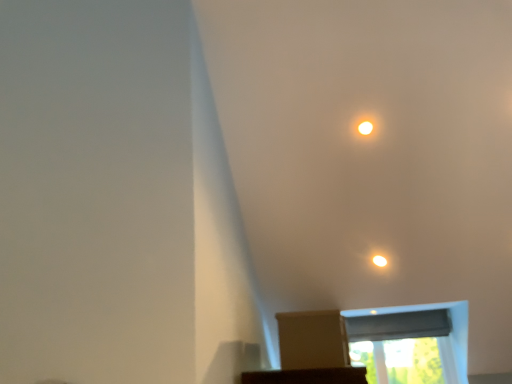
Question: From the image's perspective, is black fabric window screen at lower center, the second window screen when ordered from bottom to top, above or below transparent plastic window screen at upper center, marked as the 1th window screen in a bottom-to-top arrangement?

Choices:
 (A) below
 (B) above

Answer: (B)

Question: Considering their positions, is black fabric window screen at lower center, the 1th window screen in the top-to-bottom sequence, located in front of or behind transparent plastic window screen at upper center, arranged as the 2th window screen when viewed from the top?

Choices:
 (A) behind
 (B) front

Answer: (A)

Question: Which object is the farthest from the matte white light at upper center?

Choices:
 (A) transparent plastic window screen at upper center, arranged as the 2th window screen when viewed from the top
 (B) black fabric window screen at lower center, the second window screen when ordered from bottom to top
 (C) brown cardboard box at center
 (D) matte white light at upper center

Answer: (A)

Question: Based on their relative distances, which object is farther from the matte white light at upper center?

Choices:
 (A) brown cardboard box at center
 (B) black fabric window screen at lower center, the 1th window screen in the top-to-bottom sequence
 (C) transparent plastic window screen at upper center, arranged as the 2th window screen when viewed from the top
 (D) matte white light at upper center

Answer: (C)